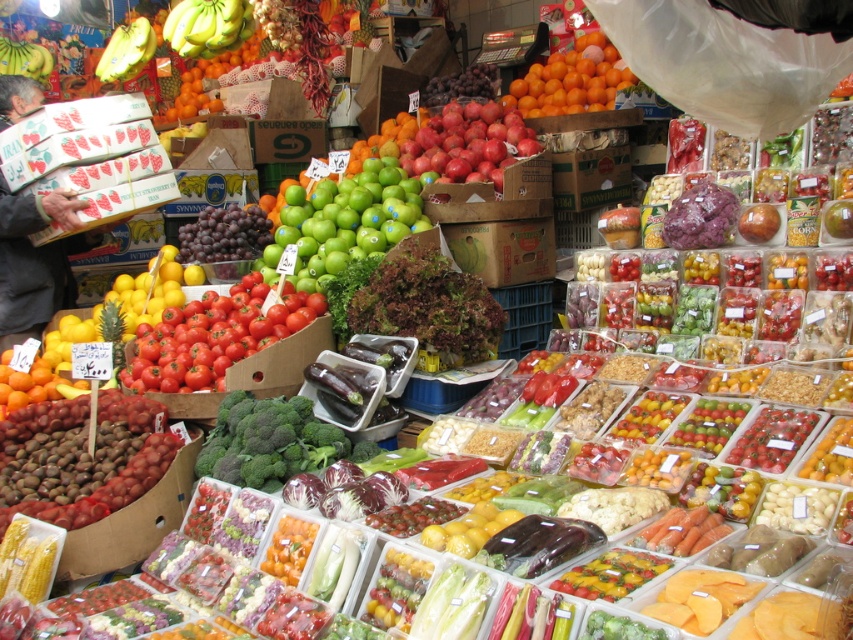
Question: Based on their relative distances, which object is nearer to the dark red leafy greens at center?

Choices:
 (A) red matte tomatoes at center
 (B) matte cardboard boxes at left
 (C) green matte apples at center
 (D) shiny red apples at center

Answer: (C)

Question: Where is red matte tomatoes at center located in relation to orange matte at upper center in the image?

Choices:
 (A) left
 (B) right

Answer: (A)

Question: Can you confirm if shiny red apples at center is positioned to the right of orange matte at upper center?

Choices:
 (A) yes
 (B) no

Answer: (B)

Question: Estimate the real-world distances between objects in this image. Which object is farther from the matte cardboard boxes at left?

Choices:
 (A) red matte tomatoes at center
 (B) shiny red apples at center
 (C) green matte apples at center
 (D) orange matte at upper center

Answer: (D)

Question: Does matte cardboard boxes at left lie in front of shiny red apples at center?

Choices:
 (A) yes
 (B) no

Answer: (B)

Question: Which point appears closest to the camera in this image?

Choices:
 (A) (410, 250)
 (B) (247, 365)
 (C) (418, 134)

Answer: (B)